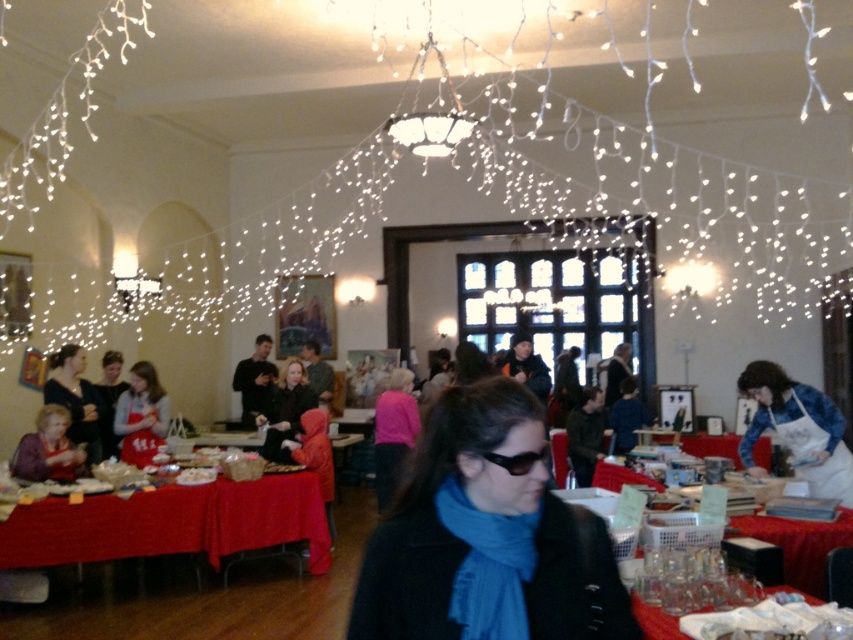
You are organizing a display for a science fair and need to place both the black matte coat at center and the black plastic goggles at center on a shelf. The shelf has limited vertical space. Which object should you place first to ensure both fit vertically?

The black matte coat at center is taller than the black plastic goggles at center, so you should place the black plastic goggles at center first to leave enough vertical space for the taller coat.

Looking at this image, you are standing at the entrance of the room and want to place a new decorative item at the point marked as point (486, 538). What is currently located there?

The black matte coat at center is located at point (486, 538).

You are organizing a display at the event and need to place both the black matte coat at center and the black plastic goggles at center on a shelf. The shelf has a width of 1 meter. If you want to place them side by side without overlapping, will they fit?

The black matte coat at center is wider than the black plastic goggles at center. However, since the shelf is 1 meter wide and the combined width of both items is not specified, it is impossible to determine if they will fit without additional information.